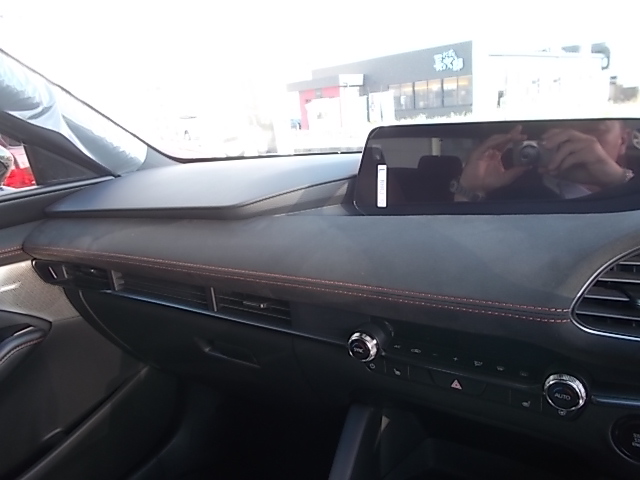
Locate an element on the screen. The image size is (640, 480). head in mirror is located at coordinates (604, 136).